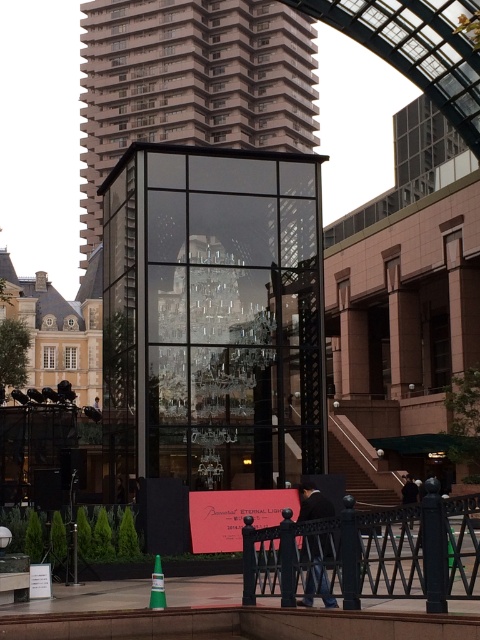
Question: Does black metal fence at lower center have a smaller size compared to matte red sign at center?

Choices:
 (A) yes
 (B) no

Answer: (B)

Question: Does black metal fence at lower center have a smaller size compared to green plastic cone at lower center?

Choices:
 (A) no
 (B) yes

Answer: (A)

Question: Which point appears farthest from the camera in this image?

Choices:
 (A) (156, 561)
 (B) (182, 120)
 (C) (213, 490)

Answer: (B)

Question: Which point is farther from the camera taking this photo?

Choices:
 (A) (189, 40)
 (B) (468, 589)
 (C) (151, 604)

Answer: (A)

Question: Which object appears farthest from the camera in this image?

Choices:
 (A) matte red sign at center
 (B) green plastic cone at lower center

Answer: (A)

Question: Is black metal fence at lower center smaller than green plastic cone at lower center?

Choices:
 (A) yes
 (B) no

Answer: (B)